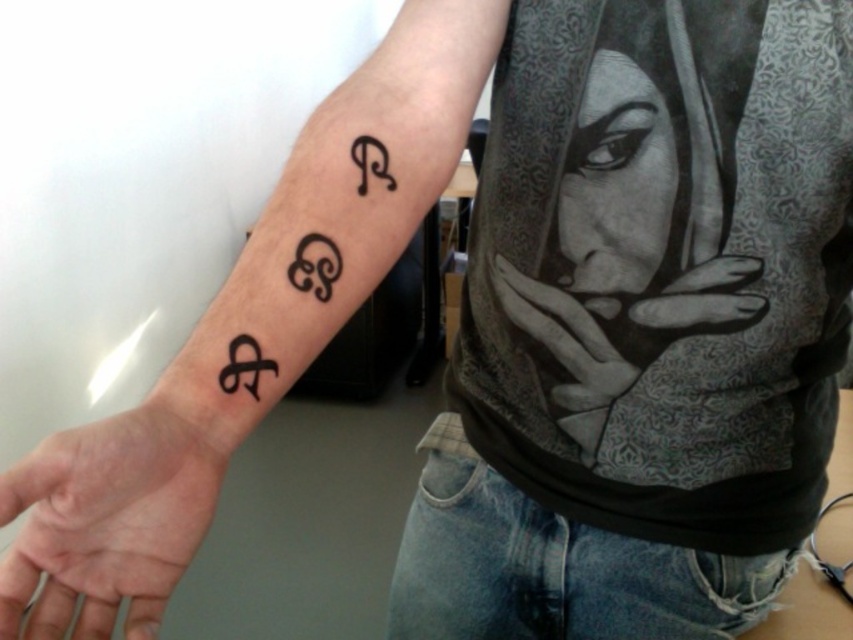
Question: Which object is the farthest from the black ink symbol at upper center?

Choices:
 (A) black matte hand at center
 (B) black ink tattoo at center
 (C) black ink tattoo at upper right

Answer: (A)

Question: Is black ink tattoo at upper right below black ink symbol at upper center?

Choices:
 (A) yes
 (B) no

Answer: (A)

Question: Estimate the real-world distances between objects in this image. Which object is farther from the smooth skin palm at lower left?

Choices:
 (A) black ink tattoo at center
 (B) black ink tattoo at upper right
 (C) black ink symbol at upper center

Answer: (C)

Question: Can you confirm if black matte hand at center is bigger than black ink symbol at upper center?

Choices:
 (A) no
 (B) yes

Answer: (B)

Question: Is black ink tattoo at upper right below smooth skin palm at lower left?

Choices:
 (A) no
 (B) yes

Answer: (A)

Question: Which object appears closest to the camera in this image?

Choices:
 (A) black ink symbol at upper center
 (B) black matte hand at center

Answer: (A)